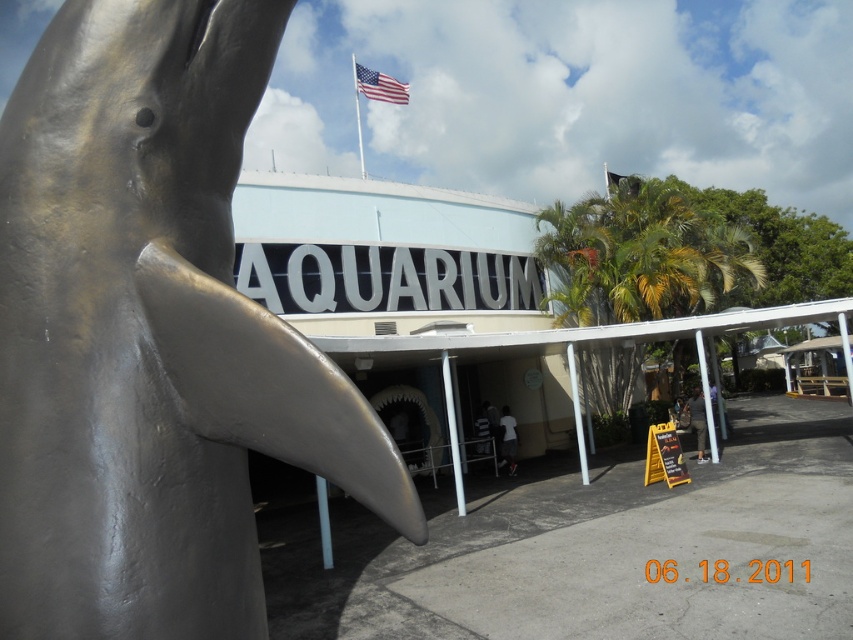
What are the coordinates of the shiny silver dolphin at left in the image?

The coordinates of the shiny silver dolphin at left are at point (149, 336).

You are a visitor standing at the entrance of the aquarium. You see the shiny silver dolphin at left and the american flag at upper center. Which object is closer to the ground?

The shiny silver dolphin at left is closer to the ground because it is positioned under the american flag at upper center.